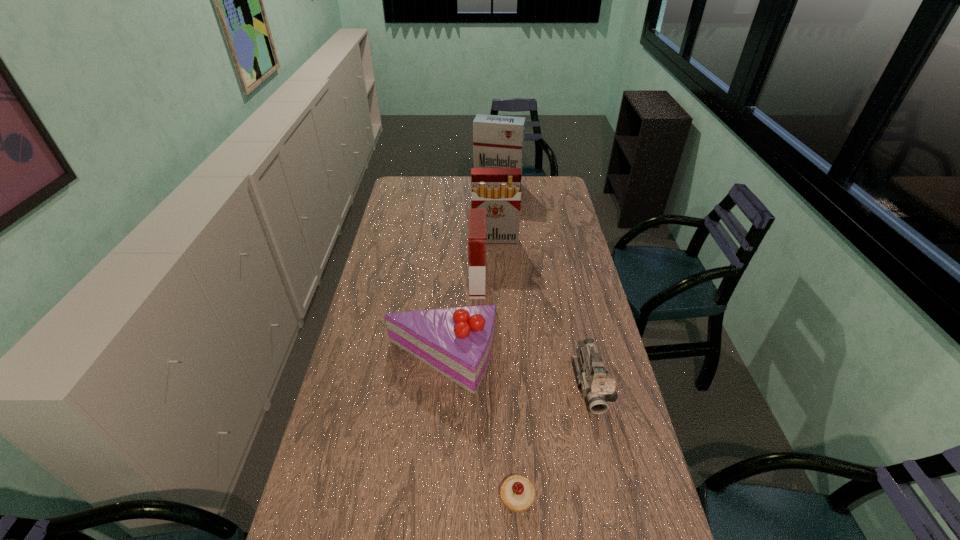
Where is `the farthest cigarette_case`? the farthest cigarette_case is located at coordinates (498, 141).

In order to click on the second farthest cigarette_case in this screenshot , I will do `click(497, 190)`.

Where is `the third farthest object`? The image size is (960, 540). the third farthest object is located at coordinates (477, 217).

Where is `cake`? This screenshot has height=540, width=960. cake is located at coordinates pyautogui.click(x=458, y=342).

What are the coordinates of `camcorder` in the screenshot? It's located at (596, 383).

Locate an element on the screen. This screenshot has height=540, width=960. the fifth tallest object is located at coordinates (596, 383).

Locate an element on the screen. The height and width of the screenshot is (540, 960). the nearest object is located at coordinates (517, 492).

Where is `pastry`? Image resolution: width=960 pixels, height=540 pixels. pastry is located at coordinates (517, 492).

This screenshot has width=960, height=540. I want to click on vacant point located on the right of the farthest object, so click(539, 186).

The image size is (960, 540). Identify the location of free region located with the lid open on the second nearest cigarette_case. (495, 266).